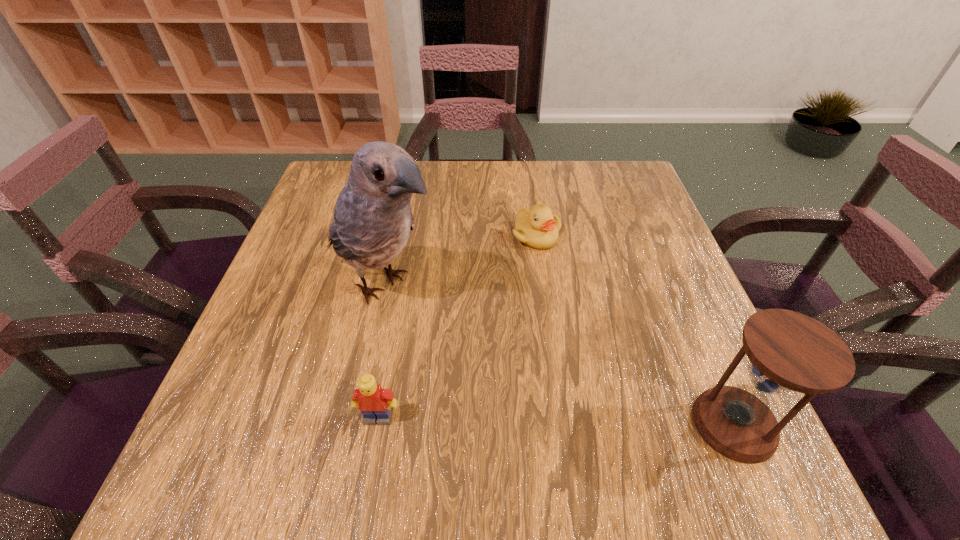
You are a GUI agent. You are given a task and a screenshot of the screen. Output one action in this format:
    pyautogui.click(x=<x>, y=<y>)
    Task: Click on the third tallest object
    The image size is (960, 540).
    Given the screenshot: What is the action you would take?
    pyautogui.click(x=374, y=402)

Identify the location of hourglass. (787, 350).

Where is `the rightmost object`? the rightmost object is located at coordinates (787, 350).

Identify the location of the farthest object. This screenshot has width=960, height=540. (538, 228).

Locate an element on the screen. This screenshot has width=960, height=540. the second object from right to left is located at coordinates (538, 228).

At what (x,y) coordinates should I click in order to perform the action: click on parrot. Please return your answer as a coordinate pair (x, y). Looking at the image, I should click on (372, 222).

I want to click on the third nearest object, so 372,222.

Image resolution: width=960 pixels, height=540 pixels. What are the coordinates of `vacant region located on the left of the hourglass` in the screenshot? It's located at (574, 424).

Locate an element on the screen. Image resolution: width=960 pixels, height=540 pixels. free region located 0.050m on the front-facing side of the duckling is located at coordinates (540, 266).

You are a GUI agent. You are given a task and a screenshot of the screen. Output one action in this format:
    pyautogui.click(x=<x>, y=<y>)
    Task: Click on the free space located 0.370m on the front-facing side of the duckling
    The height and width of the screenshot is (540, 960).
    Given the screenshot: What is the action you would take?
    pyautogui.click(x=558, y=391)